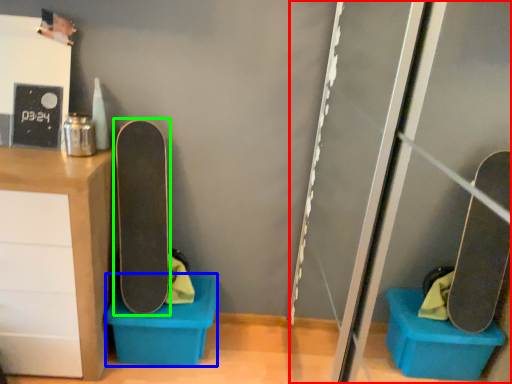
Question: Estimate the real-world distances between objects in this image. Which object is closer to screen door (highlighted by a red box), storage box (highlighted by a blue box) or skateboard (highlighted by a green box)?

Choices:
 (A) storage box
 (B) skateboard

Answer: (A)